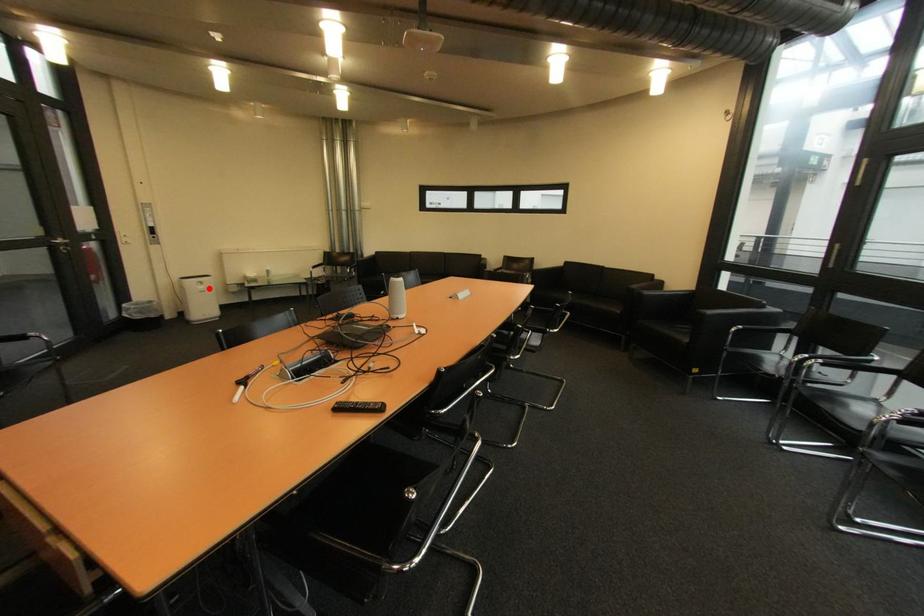
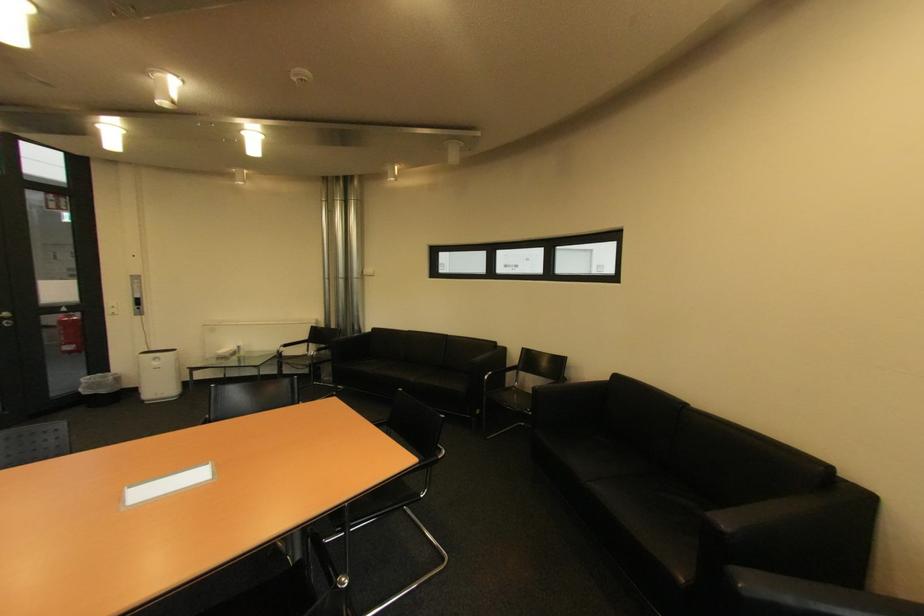
Where in the second image is the point corresponding to the highlighted location from the first image?

(164, 363)